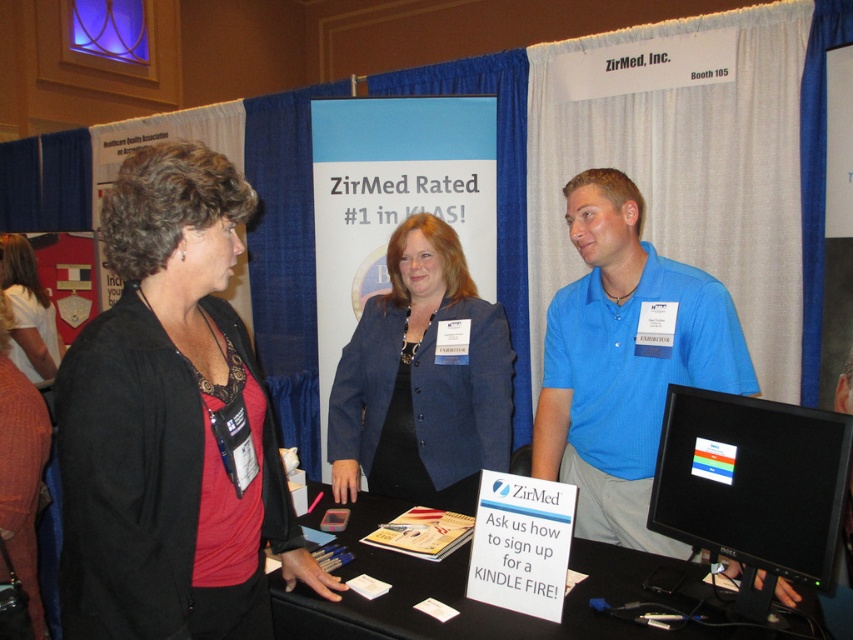
Which is more to the right, matte black blazer at center or blue fabric jacket at center?

From the viewer's perspective, blue fabric jacket at center appears more on the right side.

Is point (265, 461) behind point (486, 464)?

No, (265, 461) is closer to viewer.

Identify the location of matte black blazer at center. The width and height of the screenshot is (853, 640). (172, 422).

Does black glossy monitor at right come behind matte black shirt at left?

No, it is in front of matte black shirt at left.

Does black glossy monitor at right have a greater height compared to matte black shirt at left?

No, black glossy monitor at right is not taller than matte black shirt at left.

Identify the location of black glossy monitor at right. The width and height of the screenshot is (853, 640). (752, 481).

Consider the image. Can you confirm if matte black blazer at center is shorter than blue shirt at center?

Correct, matte black blazer at center is not as tall as blue shirt at center.

Based on the photo, is matte black blazer at center wider than blue shirt at center?

Incorrect, matte black blazer at center's width does not surpass blue shirt at center's.

Find the location of a particular element. matte black blazer at center is located at coordinates (172, 422).